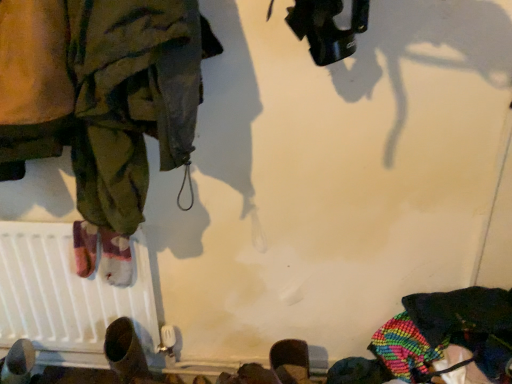
Question: Can you confirm if white matte radiator at lower left is shorter than camouflage fabric pants at left?

Choices:
 (A) no
 (B) yes

Answer: (A)

Question: Could you tell me if white matte radiator at lower left is facing camouflage fabric pants at left?

Choices:
 (A) no
 (B) yes

Answer: (A)

Question: Is white matte radiator at lower left to the left of camouflage fabric pants at left from the viewer's perspective?

Choices:
 (A) yes
 (B) no

Answer: (A)

Question: Does white matte radiator at lower left have a lesser width compared to camouflage fabric pants at left?

Choices:
 (A) no
 (B) yes

Answer: (B)

Question: Does white matte radiator at lower left have a larger size compared to camouflage fabric pants at left?

Choices:
 (A) no
 (B) yes

Answer: (A)

Question: Based on their positions, is camouflage fabric pants at left located to the left or right of white matte radiator at lower left?

Choices:
 (A) right
 (B) left

Answer: (A)

Question: Is camouflage fabric pants at left situated inside white matte radiator at lower left or outside?

Choices:
 (A) inside
 (B) outside

Answer: (B)

Question: Is camouflage fabric pants at left bigger or smaller than white matte radiator at lower left?

Choices:
 (A) big
 (B) small

Answer: (A)

Question: Considering the positions of camouflage fabric pants at left and white matte radiator at lower left in the image, is camouflage fabric pants at left wider or thinner than white matte radiator at lower left?

Choices:
 (A) wide
 (B) thin

Answer: (A)

Question: From their relative heights in the image, would you say brown leather shoe at lower left is taller or shorter than white matte radiator at lower left?

Choices:
 (A) short
 (B) tall

Answer: (A)

Question: Based on their sizes in the image, would you say brown leather shoe at lower left is bigger or smaller than white matte radiator at lower left?

Choices:
 (A) small
 (B) big

Answer: (A)

Question: From a real-world perspective, is brown leather shoe at lower left positioned above or below white matte radiator at lower left?

Choices:
 (A) below
 (B) above

Answer: (A)

Question: Considering the relative positions of brown leather shoe at lower left and white matte radiator at lower left in the image provided, is brown leather shoe at lower left to the left or to the right of white matte radiator at lower left?

Choices:
 (A) right
 (B) left

Answer: (A)

Question: From the image's perspective, is brown leather shoe at lower left located above or below camouflage fabric pants at left?

Choices:
 (A) below
 (B) above

Answer: (A)

Question: Is brown leather shoe at lower left inside or outside of camouflage fabric pants at left?

Choices:
 (A) outside
 (B) inside

Answer: (A)